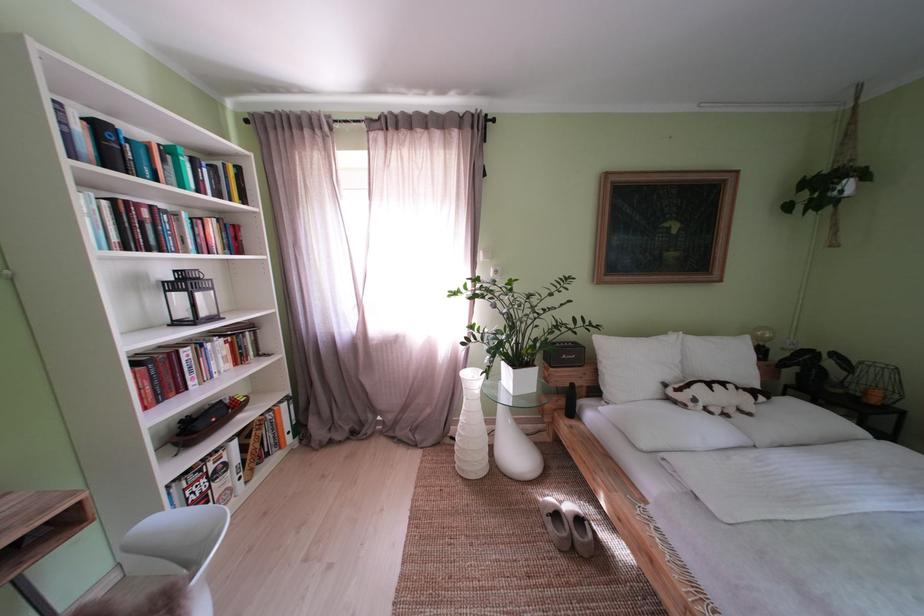
The width and height of the screenshot is (924, 616). What do you see at coordinates (494, 272) in the screenshot?
I see `a white light switch` at bounding box center [494, 272].